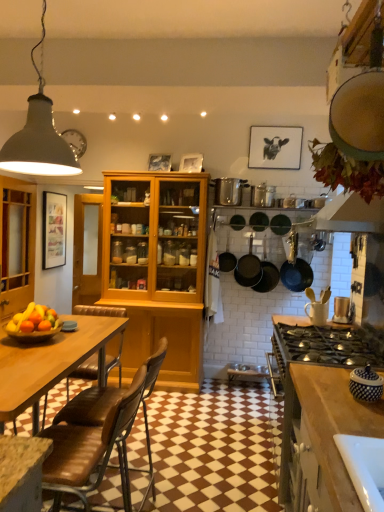
Find the location of `vacant space positioned to the left of white textured jar at lower right, which appears as the 2th appliance when viewed from the right`. vacant space positioned to the left of white textured jar at lower right, which appears as the 2th appliance when viewed from the right is located at coordinates (325, 387).